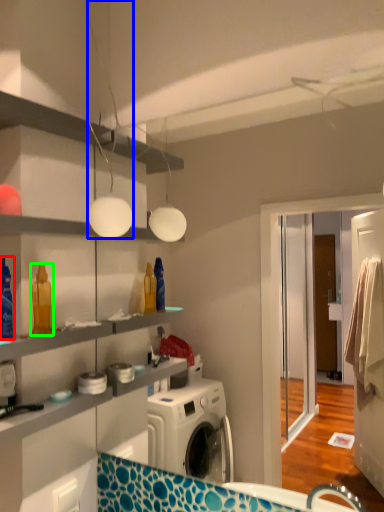
Question: Based on their relative distances, which object is nearer to cleaning product (highlighted by a red box)? Choose from light fixture (highlighted by a blue box) and cleaning product (highlighted by a green box).

Choices:
 (A) light fixture
 (B) cleaning product

Answer: (B)